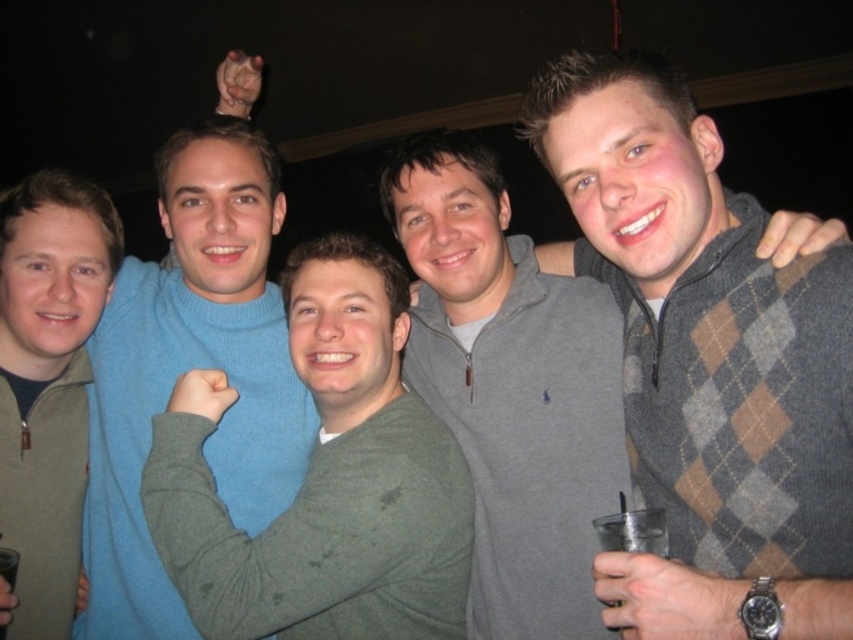
You are at a party and want to know if the gray argyle sweater at center is closer to you than the green fuzzy sweater at center. Can you determine this based on their positions?

The gray argyle sweater at center is 35.24 centimeters from the green fuzzy sweater at center. Since both are at the same central position, their distance from you would depend on their depth placement, but the given information only specifies the distance between them, not their individual distances from you. Therefore, it cannot be determined which is closer to you based solely on the provided details.

You are organizing a charity event and need to determine which of the two sweaters, the matte blue sweater at center or the matte green sweater at left, would be more suitable for a size 12 donation bin. Based on their sizes, which sweater should you place in the bin?

The matte blue sweater at center is larger in size than the matte green sweater at left, so it would be more appropriate to place the matte blue sweater at center in the size 12 donation bin.